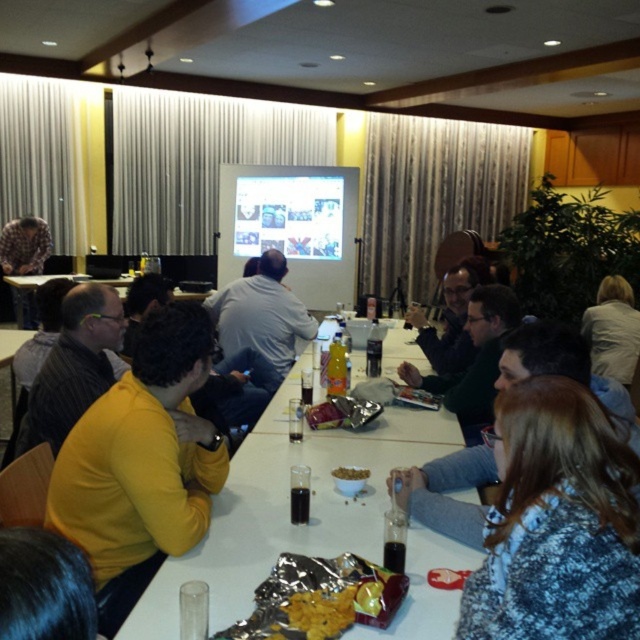
From the picture: You are sitting at the conference table and need to reach the yellow matte sweater at left and the matte plastic projector screen at center. Which object is closer to your current position?

The yellow matte sweater at left is closer to your current position because it is located below the matte plastic projector screen at center, meaning it is positioned lower and nearer to the table where you are sitting.

In the scene shown: You are sitting at the table and want to reach for the brown matte bowl at center without moving your chair. Which direction should you move your hand relative to the light gray shirt at center?

The light gray shirt at center is to the left of the brown matte bowl at center, so you should move your hand to the right of the light gray shirt at center to reach the brown matte bowl at center.

You are standing at the front of the conference room facing the long white rectangular table. There are two points marked on the table surface at coordinates point (156, 320) and point (317, 282). If you want to place a small object on the table closer to you, which point should you choose?

You should choose point (156, 320) because it is closer to the camera, which represents your position at the front of the room.